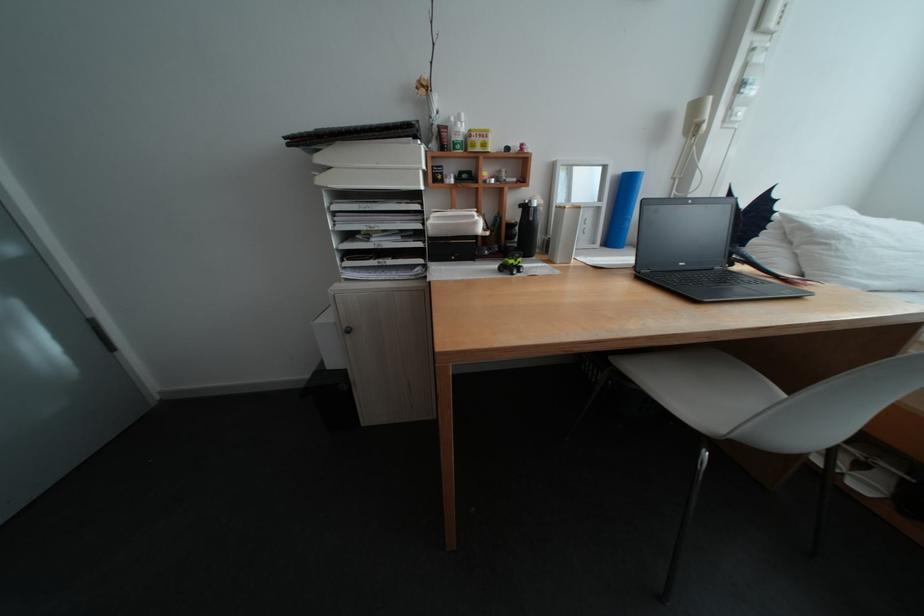
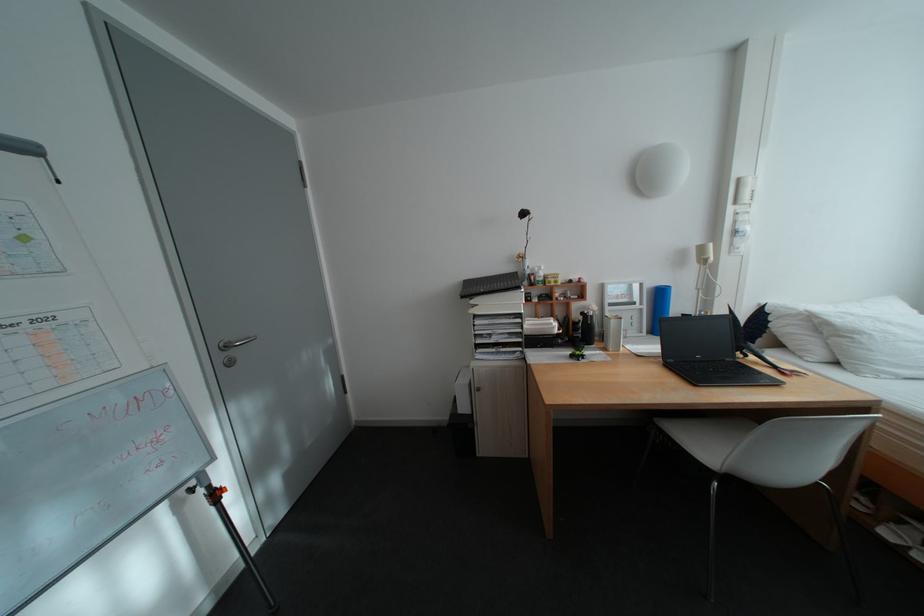
The point at (x=563, y=262) is marked in the first image. Where is the corresponding point in the second image?

(617, 350)